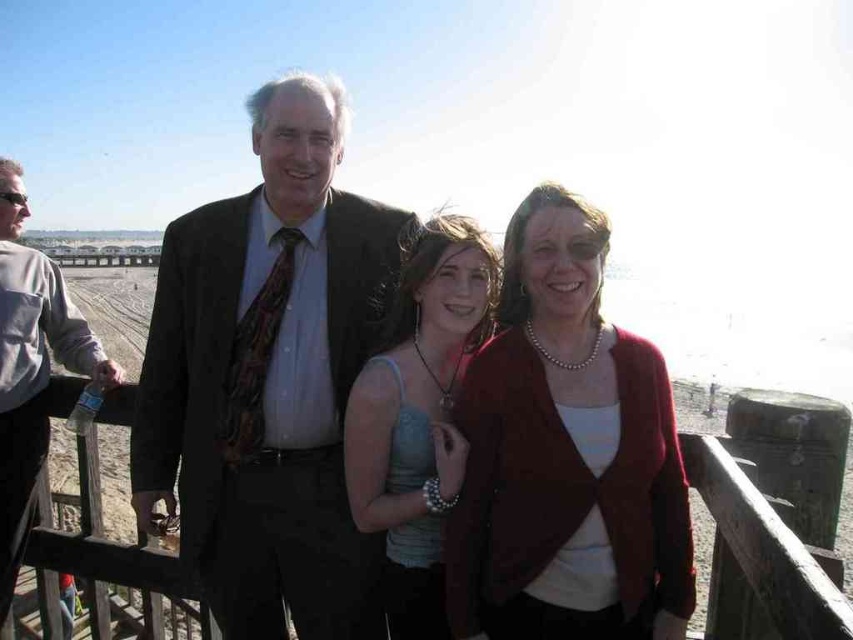
Is matte black suit at center further to the viewer compared to wooden at center?

Yes.

Which is behind, point (231, 404) or point (712, 493)?

Positioned behind is point (231, 404).

Image resolution: width=853 pixels, height=640 pixels. Identify the location of matte black suit at center. (268, 380).

Is matte red cardigan at center below matte blue tank top at center?

Yes.

This screenshot has height=640, width=853. What are the coordinates of `matte red cardigan at center` in the screenshot? It's located at (566, 454).

Does matte red cardigan at center appear over wooden at center?

Yes.

Is matte red cardigan at center in front of wooden at center?

No, it is not.

Locate an element on the screen. Image resolution: width=853 pixels, height=640 pixels. matte red cardigan at center is located at coordinates (566, 454).